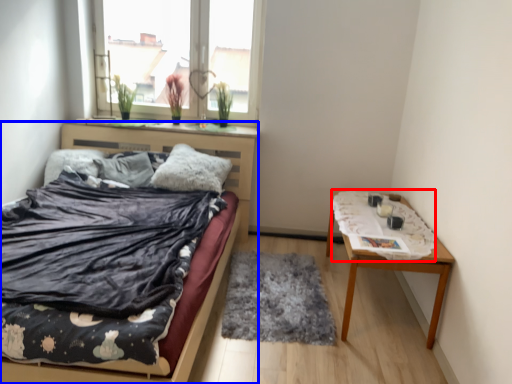
Question: Which object is closer to the camera taking this photo, blanket (highlighted by a red box) or bed (highlighted by a blue box)?

Choices:
 (A) blanket
 (B) bed

Answer: (B)